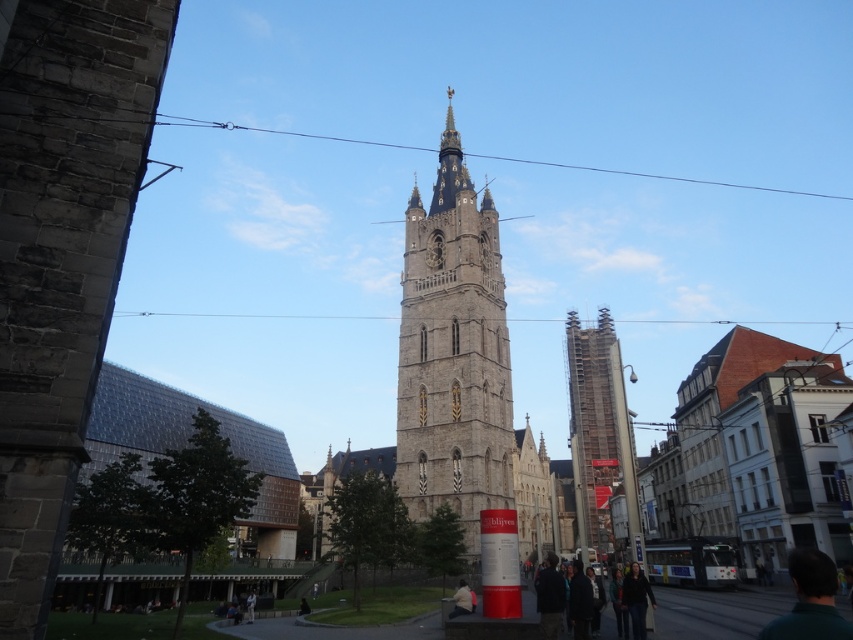
You are standing at the center of the image. Which direction should you move to get closer to the stone tower at center?

Since the stone tower at center is already at the center of the image, you are already facing the stone tower at center. There is no need to move in any direction to get closer.

You are an architect looking at the historic urban scene. You need to determine the spatial relationship between the stone tower at center and the scaffolding wood at right. Which one is positioned higher in the image?

The stone tower at center is above scaffolding wood at right, so the stone tower at center is positioned higher in the image.